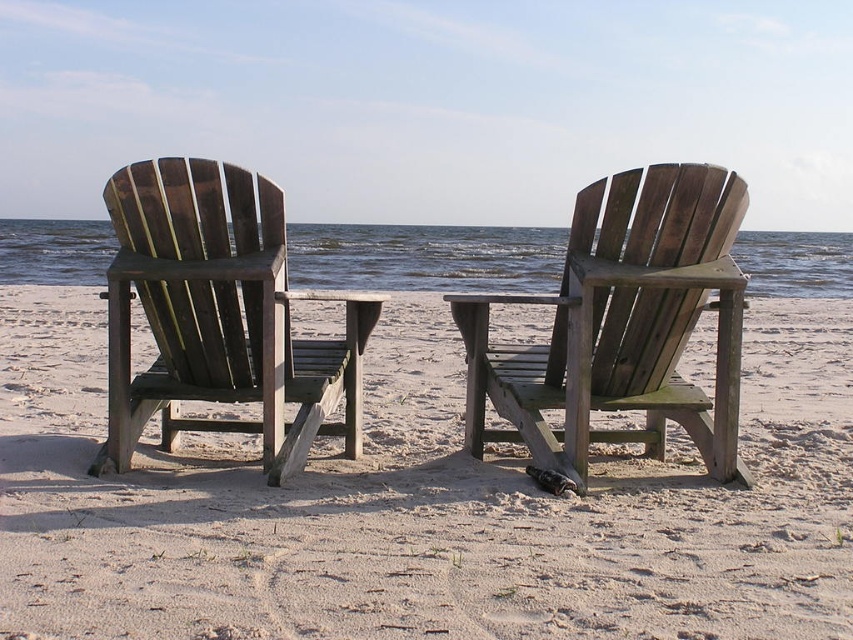
Question: Is the position of weathered wood chairs at center more distant than that of dark brown wood beach chair at left?

Choices:
 (A) yes
 (B) no

Answer: (B)

Question: Can you confirm if weathered wood chairs at center is positioned to the left of wooden beach chair at center?

Choices:
 (A) yes
 (B) no

Answer: (B)

Question: Does weathered wood chairs at center have a larger size compared to wooden beach chair at center?

Choices:
 (A) no
 (B) yes

Answer: (B)

Question: Estimate the real-world distances between objects in this image. Which object is farther from the wooden beach chair at center?

Choices:
 (A) dark brown wood beach chair at left
 (B) weathered wood chairs at center

Answer: (B)

Question: Which point is farther from the camera taking this photo?

Choices:
 (A) (285, 301)
 (B) (279, 611)
 (C) (738, 209)

Answer: (A)

Question: Which point is closer to the camera?

Choices:
 (A) dark brown wood beach chair at left
 (B) wooden beach chair at center
 (C) weathered wood chairs at center

Answer: (C)